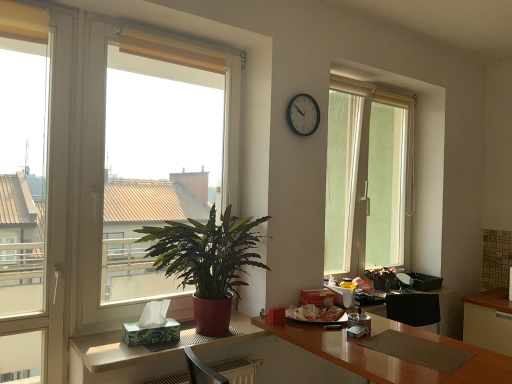
Locate an element on the screen. vacant space that is to the left of white cardboard tissue at lower left is located at coordinates (101, 340).